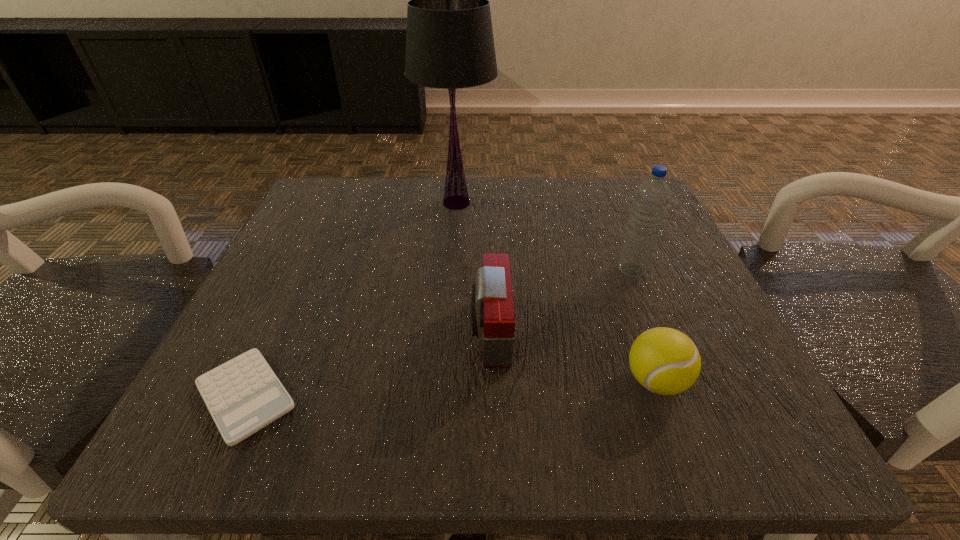
Find the location of `object that is the third closest to the shortest object`. object that is the third closest to the shortest object is located at coordinates (665, 361).

Point out which object is positioned as the nearest to the calculator. Please provide its 2D coordinates. Your answer should be formatted as a tuple, i.e. [(x, y)], where the tuple contains the x and y coordinates of a point satisfying the conditions above.

[(492, 315)]

The width and height of the screenshot is (960, 540). Identify the location of vacant space that satisfies the following two spatial constraints: 1. on the front-facing side of the tallest object; 2. on the left side of the water bottle. pyautogui.click(x=451, y=269).

What are the coordinates of `blank area in the image that satisfies the following two spatial constraints: 1. on the front-facing side of the third tallest object; 2. on the left side of the tennis ball` in the screenshot? It's located at (491, 381).